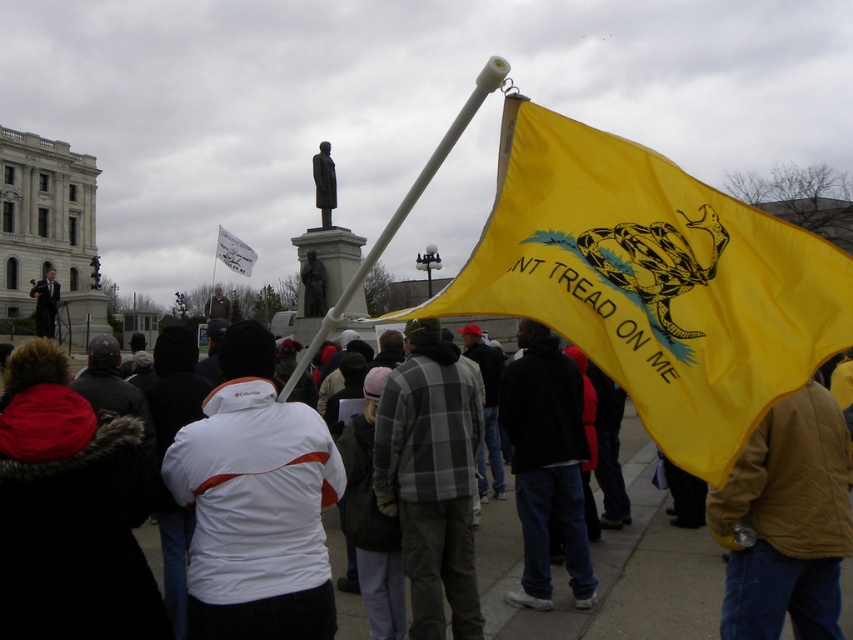
Can you confirm if white fleece jacket at center is shorter than brown leather jacket at lower right?

No.

Find the location of `white fleece jacket at center`. white fleece jacket at center is located at coordinates (254, 502).

Which is more to the left, white fleece jacket at center or white plastic flag at center?

From the viewer's perspective, white plastic flag at center appears more on the left side.

Can you confirm if white fleece jacket at center is positioned to the right of white plastic flag at center?

Yes, white fleece jacket at center is to the right of white plastic flag at center.

Locate an element on the screen. The width and height of the screenshot is (853, 640). white fleece jacket at center is located at coordinates (254, 502).

Can you confirm if yellow fabric flag at center is positioned above plaid fleece jacket at center?

Yes, yellow fabric flag at center is above plaid fleece jacket at center.

Who is taller, yellow fabric flag at center or plaid fleece jacket at center?

yellow fabric flag at center is taller.

Is point (722, 358) positioned before point (393, 464)?

That is True.

The image size is (853, 640). I want to click on yellow fabric flag at center, so 653,282.